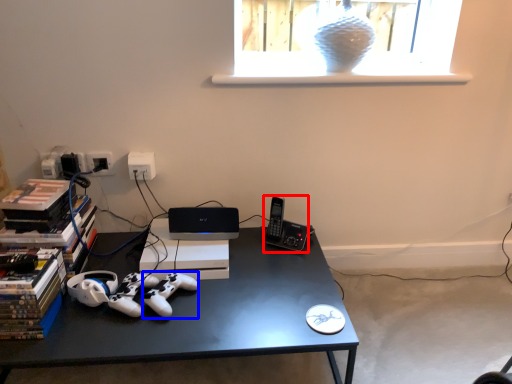
Question: Which object is closer to the camera taking this photo, gadget (highlighted by a red box) or game controller (highlighted by a blue box)?

Choices:
 (A) gadget
 (B) game controller

Answer: (B)